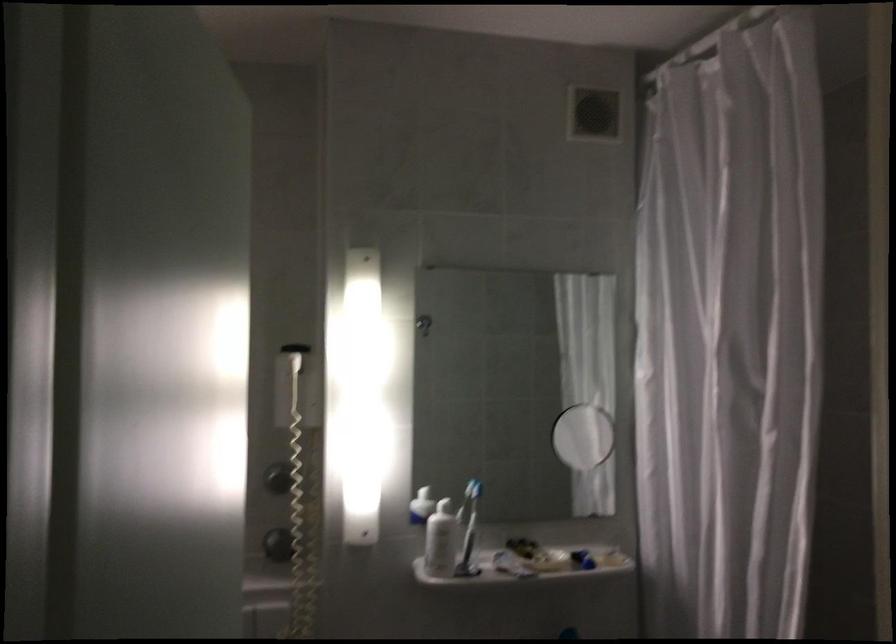
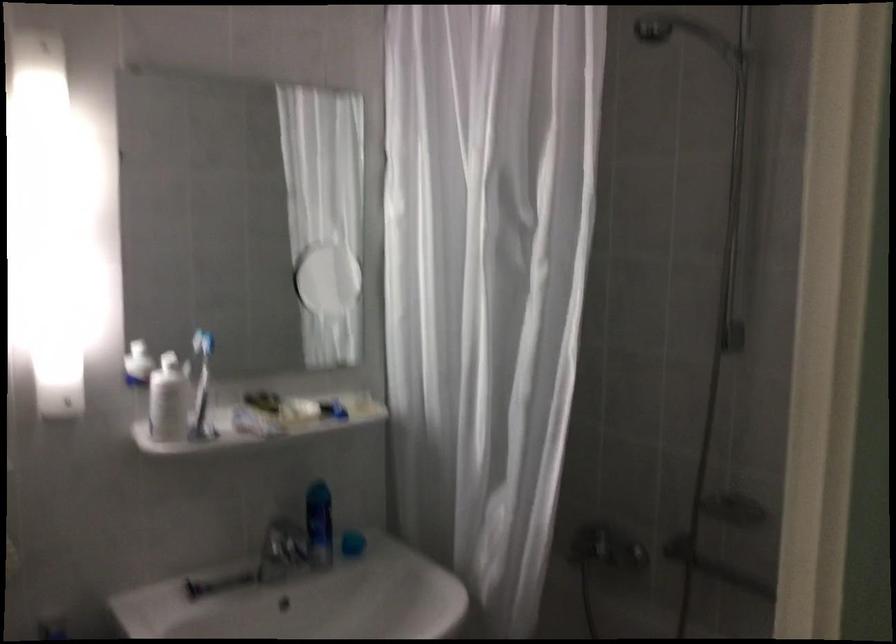
Question: The images are taken continuously from a first-person perspective. In which direction is your viewpoint rotating?

Choices:
 (A) Left
 (B) Right
 (C) Up
 (D) Down

Answer: (B)